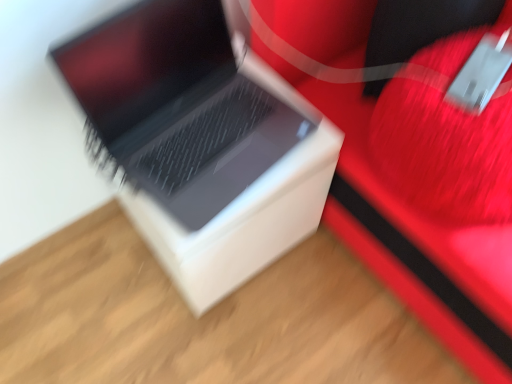
Question: Is sleek silver laptop at center inside white matte cardboard box at center?

Choices:
 (A) yes
 (B) no

Answer: (B)

Question: Does white matte cardboard box at center appear on the left side of sleek silver laptop at center?

Choices:
 (A) no
 (B) yes

Answer: (B)

Question: From a real-world perspective, is white matte cardboard box at center under sleek silver laptop at center?

Choices:
 (A) yes
 (B) no

Answer: (A)

Question: Is white matte cardboard box at center aimed at sleek silver laptop at center?

Choices:
 (A) yes
 (B) no

Answer: (B)

Question: Is the depth of white matte cardboard box at center less than that of sleek silver laptop at center?

Choices:
 (A) no
 (B) yes

Answer: (A)

Question: Does white matte cardboard box at center have a lesser width compared to sleek silver laptop at center?

Choices:
 (A) no
 (B) yes

Answer: (A)

Question: Is sleek silver laptop at center far away from rubberized red suitcase at center?

Choices:
 (A) no
 (B) yes

Answer: (A)

Question: Is sleek silver laptop at center aimed at rubberized red suitcase at center?

Choices:
 (A) no
 (B) yes

Answer: (A)

Question: From the image's perspective, does sleek silver laptop at center appear lower than rubberized red suitcase at center?

Choices:
 (A) no
 (B) yes

Answer: (B)

Question: Would you say sleek silver laptop at center contains rubberized red suitcase at center?

Choices:
 (A) no
 (B) yes

Answer: (A)

Question: From the image's perspective, is sleek silver laptop at center above rubberized red suitcase at center?

Choices:
 (A) no
 (B) yes

Answer: (A)

Question: Is sleek silver laptop at center taller than rubberized red suitcase at center?

Choices:
 (A) no
 (B) yes

Answer: (A)

Question: Does rubberized red suitcase at center appear on the right side of white matte cardboard box at center?

Choices:
 (A) no
 (B) yes

Answer: (B)